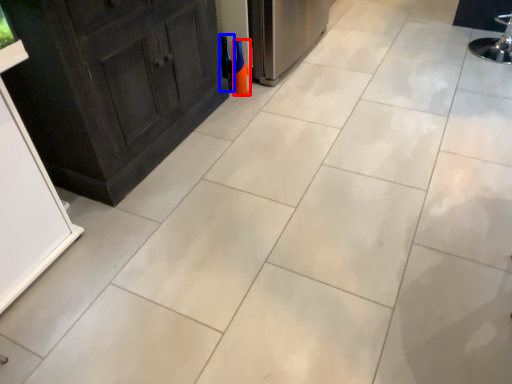
Question: Which point is closer to the camera, bottle (highlighted by a red box) or wine bottle (highlighted by a blue box)?

Choices:
 (A) bottle
 (B) wine bottle

Answer: (A)